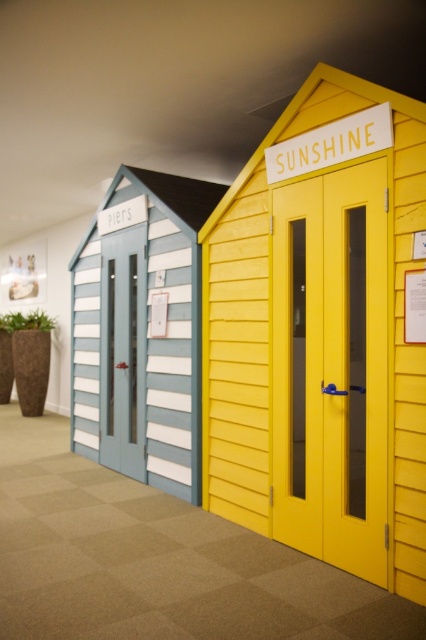
Question: Which point appears closest to the camera in this image?

Choices:
 (A) (127, 244)
 (B) (146, 355)

Answer: (B)

Question: Is yellow wooden beach hut at center behind matte white door at center?

Choices:
 (A) yes
 (B) no

Answer: (B)

Question: Which of the following is the closest to the observer?

Choices:
 (A) blue striped wooden hut at center
 (B) yellow matte door at center

Answer: (B)

Question: Is blue striped wooden hut at center further to the viewer compared to matte white door at center?

Choices:
 (A) yes
 (B) no

Answer: (B)

Question: Can you confirm if blue striped wooden hut at center is smaller than matte white door at center?

Choices:
 (A) no
 (B) yes

Answer: (A)

Question: Which object is the farthest from the matte white door at center?

Choices:
 (A) blue striped wooden hut at center
 (B) yellow wooden beach hut at center
 (C) yellow matte door at center

Answer: (C)